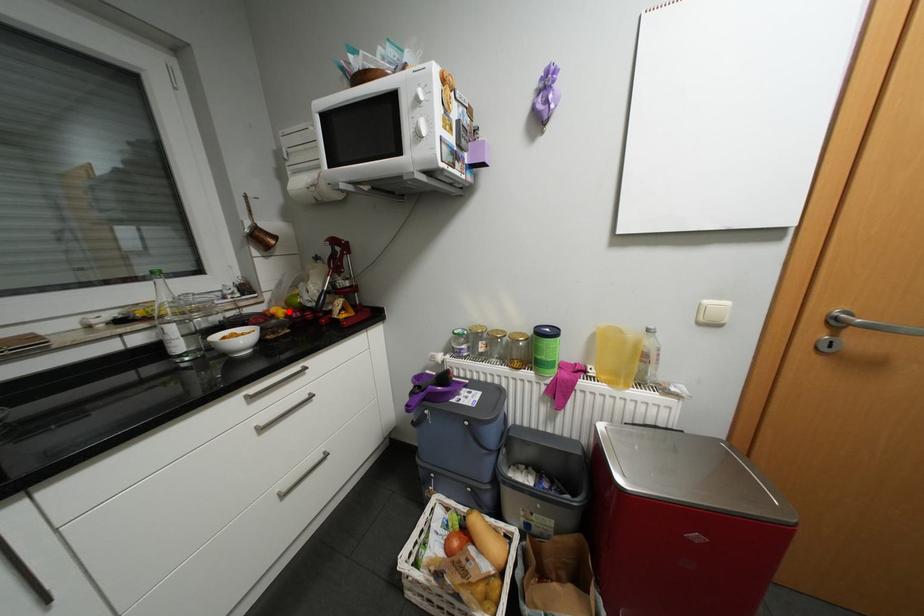
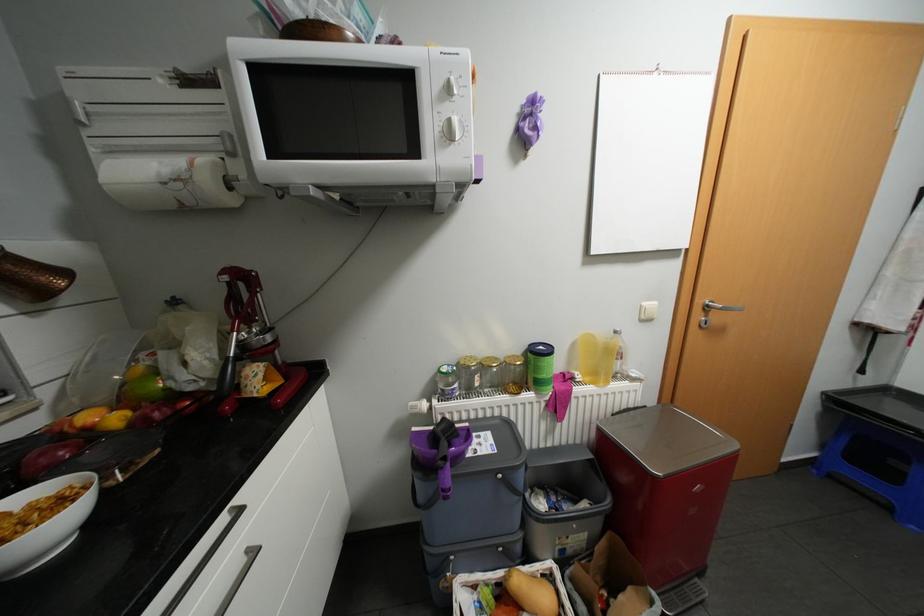
Locate, in the second image, the point that corresponds to the highlighted location in the first image.

(123, 418)